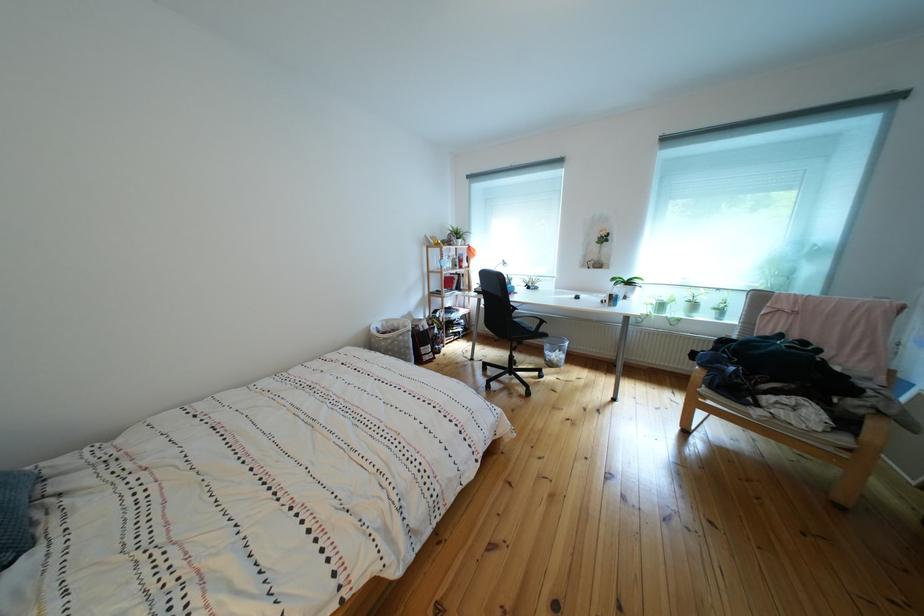
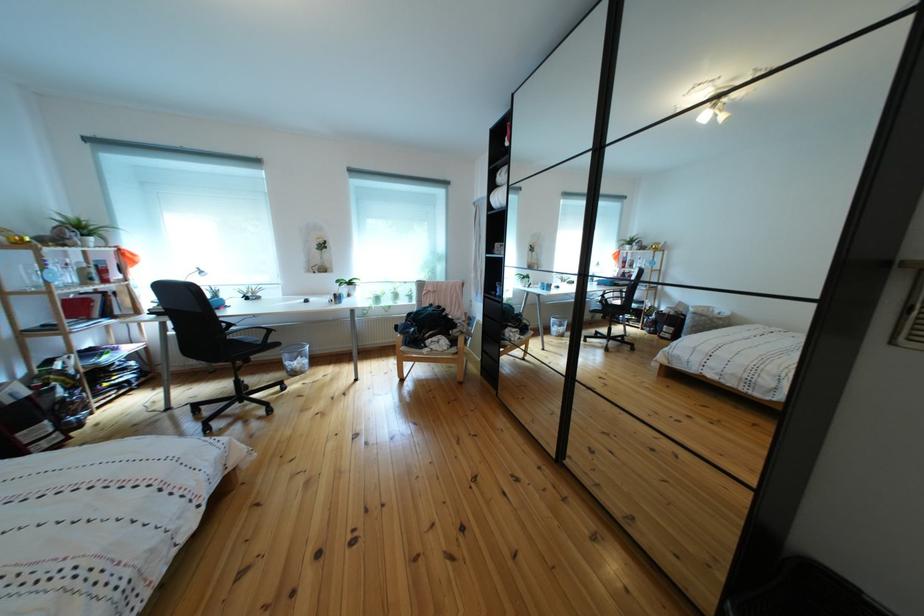
Find the pixel in the second image that matches point 533,283 in the first image.

(247, 293)